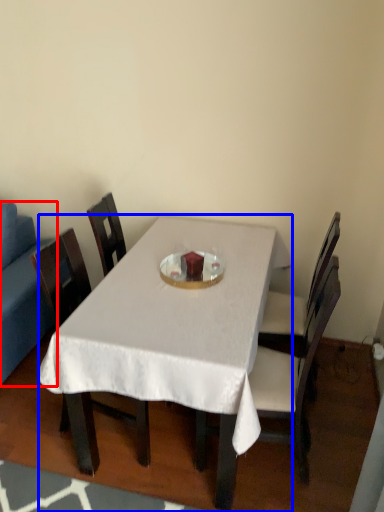
Question: Which of the following is the closest to the observer, studio couch (highlighted by a red box) or desk (highlighted by a blue box)?

Choices:
 (A) studio couch
 (B) desk

Answer: (B)